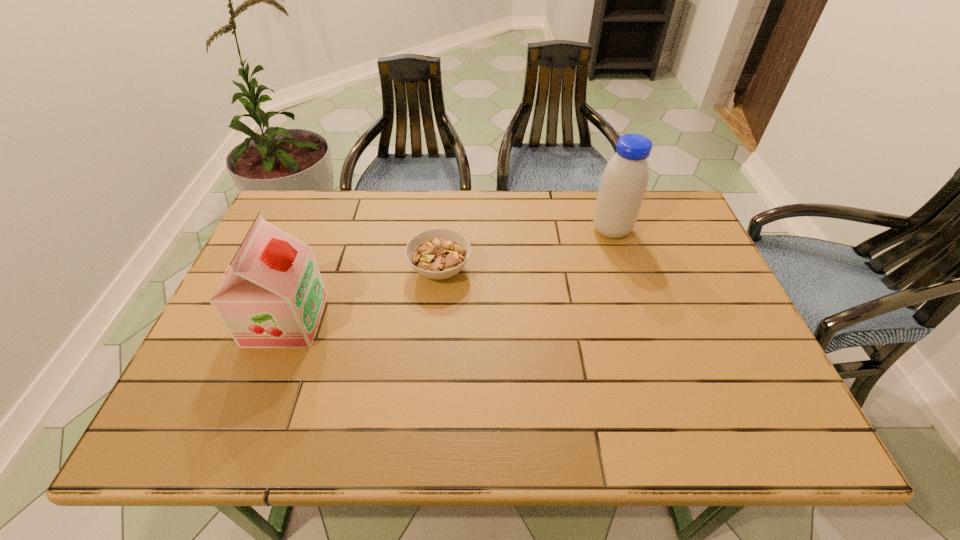
Where is `the farther soya milk`? This screenshot has height=540, width=960. the farther soya milk is located at coordinates (624, 181).

At what (x,y) coordinates should I click in order to perform the action: click on the right soya milk. Please return your answer as a coordinate pair (x, y). The image size is (960, 540). Looking at the image, I should click on (624, 181).

Identify the location of the nearest object. Image resolution: width=960 pixels, height=540 pixels. (272, 295).

At what (x,y) coordinates should I click in order to perform the action: click on the left soya milk. Please return your answer as a coordinate pair (x, y). The height and width of the screenshot is (540, 960). Looking at the image, I should click on (272, 295).

Identify the location of the shortest object. The width and height of the screenshot is (960, 540). (439, 253).

Where is `stew`? This screenshot has height=540, width=960. stew is located at coordinates (439, 253).

What are the coordinates of `vacant point located 0.400m on the front of the right soya milk` in the screenshot? It's located at (653, 361).

Where is `free point located with the cap open on the leftmost object`? free point located with the cap open on the leftmost object is located at coordinates 418,320.

Image resolution: width=960 pixels, height=540 pixels. I want to click on free spot located on the right of the second object from left to right, so click(534, 269).

Locate an element on the screen. This screenshot has width=960, height=540. object situated at the far edge is located at coordinates (624, 181).